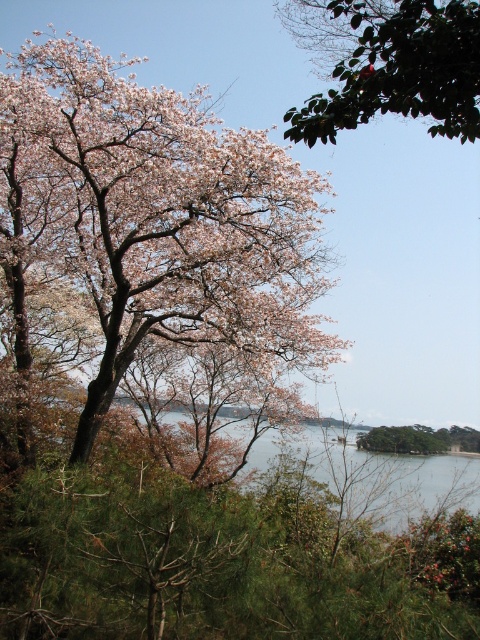
Question: Which object appears closest to the camera in this image?

Choices:
 (A) pink matte flower at upper left
 (B) green glossy leaf at upper center

Answer: (B)

Question: Which object is closer to the camera taking this photo?

Choices:
 (A) pink matte flower at upper left
 (B) green glossy leaf at upper center

Answer: (B)

Question: Can you confirm if pink matte flower at upper left is positioned to the left of green glossy leaf at upper center?

Choices:
 (A) no
 (B) yes

Answer: (B)

Question: Is pink matte flower at upper left smaller than green glossy leaf at upper center?

Choices:
 (A) yes
 (B) no

Answer: (B)

Question: Which point is closer to the camera?

Choices:
 (A) [131, 138]
 (B) [452, 106]

Answer: (B)

Question: Is pink matte flower at upper left wider than green glossy leaf at upper center?

Choices:
 (A) no
 (B) yes

Answer: (B)